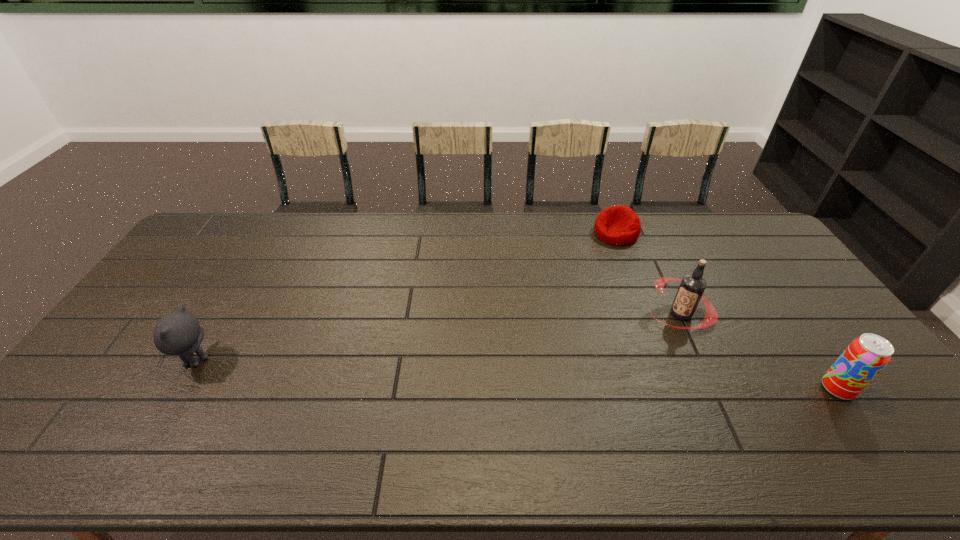
Identify the location of vacant area at the near edge of the desktop. The width and height of the screenshot is (960, 540). (167, 415).

I want to click on vacant space at the right edge of the desktop, so click(x=761, y=284).

Locate an element on the screen. The image size is (960, 540). free spot between the kitten and the rightmost object is located at coordinates (516, 375).

Where is `vacant area between the shortest object and the rightmost object`? vacant area between the shortest object and the rightmost object is located at coordinates (727, 311).

Identify the location of vacant point located between the leftmost object and the shortest object. This screenshot has height=540, width=960. pos(405,296).

Locate an element on the screen. vacant space that is in between the root beer and the soda can is located at coordinates click(x=758, y=351).

Locate an element on the screen. Image resolution: width=960 pixels, height=540 pixels. empty location between the soda can and the beanbag is located at coordinates (727, 311).

I want to click on free point between the kitten and the rightmost object, so click(516, 375).

The width and height of the screenshot is (960, 540). I want to click on blank region between the rightmost object and the kitten, so click(x=516, y=375).

The height and width of the screenshot is (540, 960). What are the coordinates of `free point between the rightmost object and the leftmost object` in the screenshot? It's located at (516, 375).